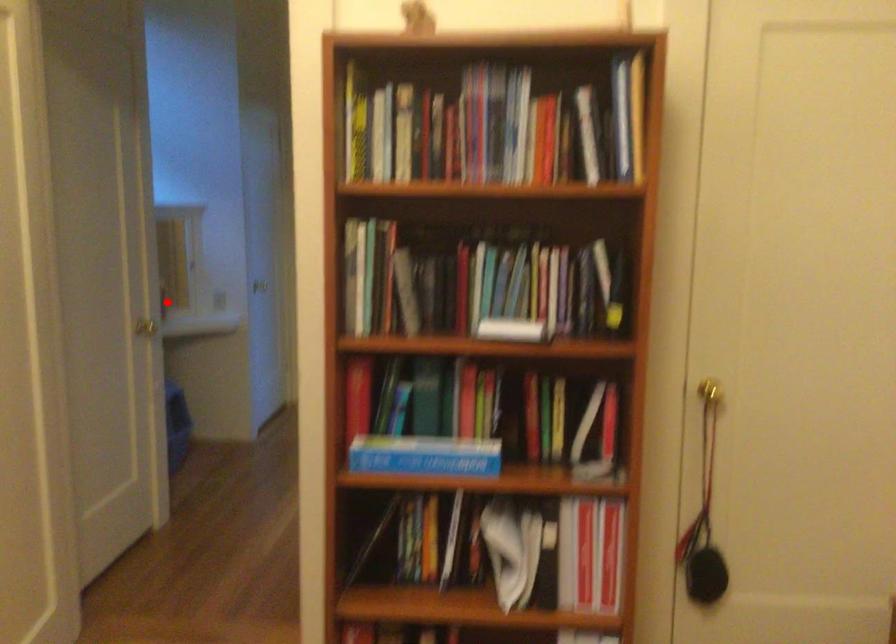
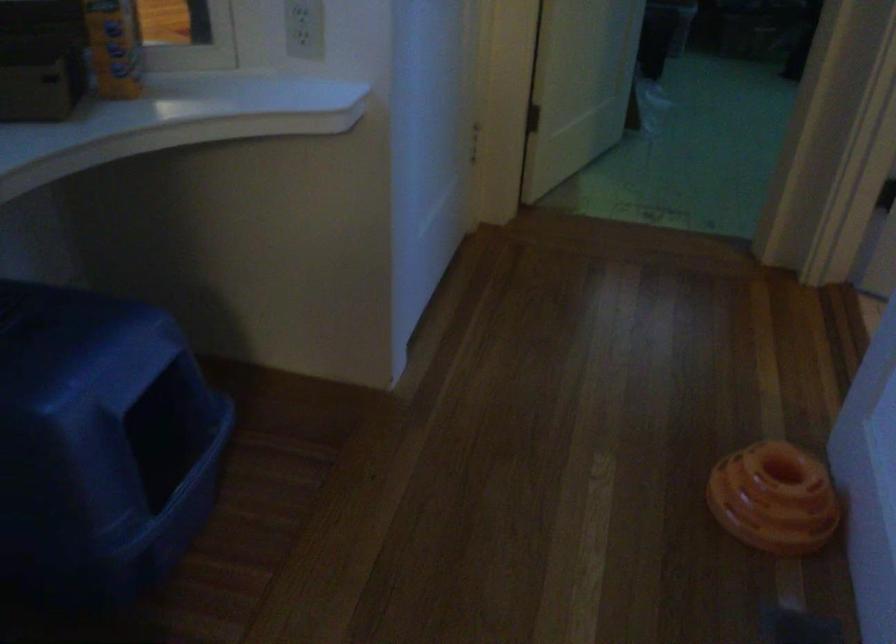
Question: I am providing you with two images of the same scene from different viewpoints. Image1 has a red point marked. In image2, the corresponding 3D location appears at what relative position? Reply with the corresponding letter.

Choices:
 (A) Closer
 (B) Farther

Answer: (A)